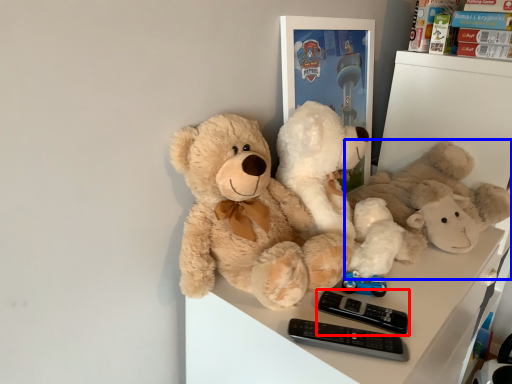
Question: Which of the following is the farthest to the observer, control (highlighted by a red box) or teddy bear (highlighted by a blue box)?

Choices:
 (A) control
 (B) teddy bear

Answer: (B)